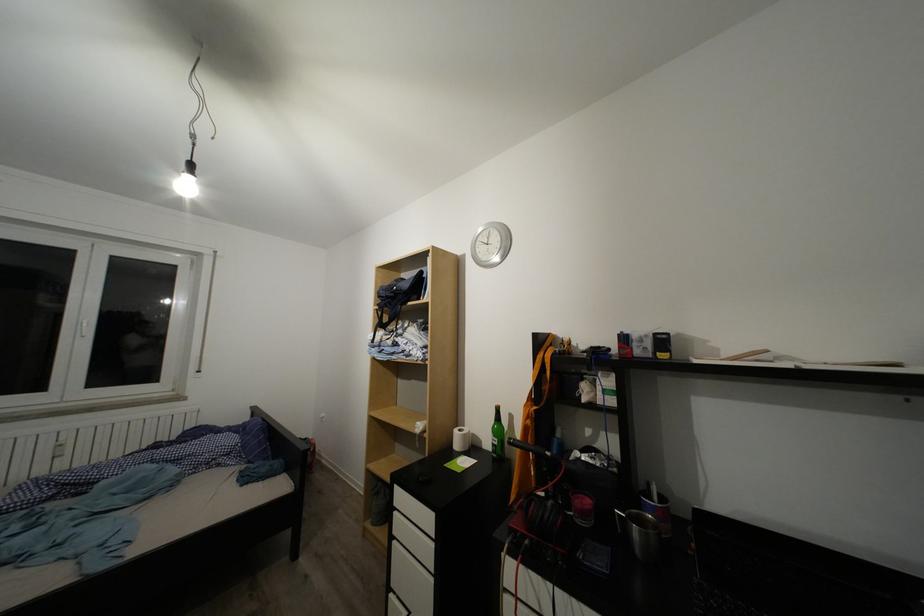
The width and height of the screenshot is (924, 616). Describe the element at coordinates (581, 509) in the screenshot. I see `a red cup` at that location.